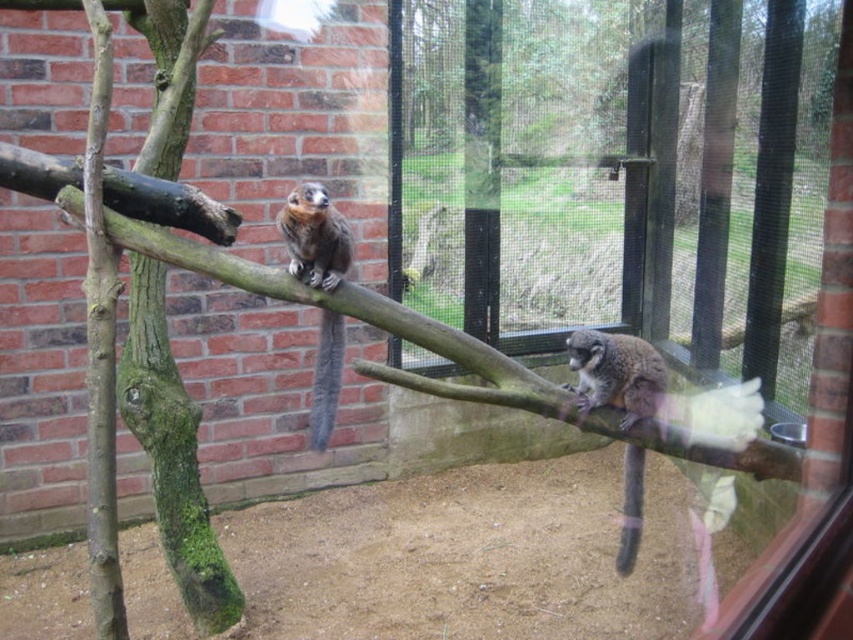
Who is positioned more to the left, brown textured branch at upper center or brown furry tail at lower right?

brown textured branch at upper center

Based on the photo, who is more distant from viewer, (764,458) or (640,477)?

Positioned behind is point (640,477).

Identify the location of brown textured branch at upper center. The image size is (853, 640). (389, 324).

Consider the image. Who is positioned more to the left, brown textured branch at upper center or gray furry tail at center?

Positioned to the left is gray furry tail at center.

Does brown textured branch at upper center have a lesser height compared to gray furry tail at center?

In fact, brown textured branch at upper center may be taller than gray furry tail at center.

Is point (553, 403) positioned behind point (310, 420)?

No, (553, 403) is in front of (310, 420).

At what (x,y) coordinates should I click in order to perform the action: click on brown textured branch at upper center. Please return your answer as a coordinate pair (x, y). Looking at the image, I should click on (389, 324).

Does brown textured branch at upper center have a smaller size compared to brown furry monkey at upper left?

Actually, brown textured branch at upper center might be larger than brown furry monkey at upper left.

Can you confirm if brown textured branch at upper center is bigger than brown furry monkey at upper left?

Yes, brown textured branch at upper center is bigger than brown furry monkey at upper left.

Does point (396, 330) come farther from viewer compared to point (296, 275)?

No, it is in front of (296, 275).

Where is `brown textured branch at upper center`? Image resolution: width=853 pixels, height=640 pixels. brown textured branch at upper center is located at coordinates (389, 324).